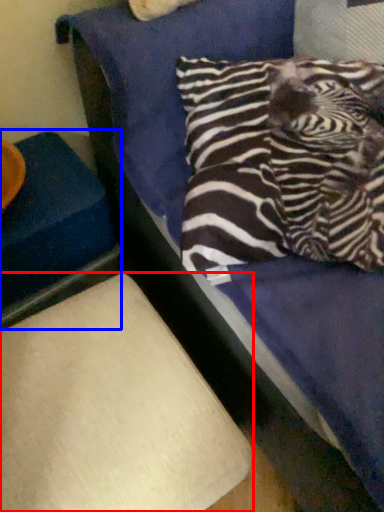
Question: Which object appears closest to the camera in this image, furniture (highlighted by a red box) or furniture (highlighted by a blue box)?

Choices:
 (A) furniture
 (B) furniture

Answer: (A)